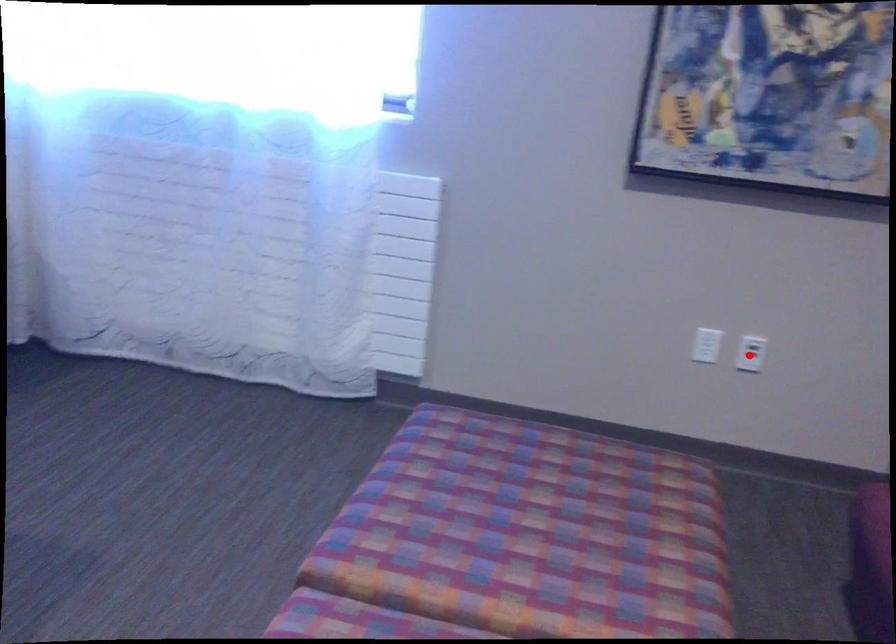
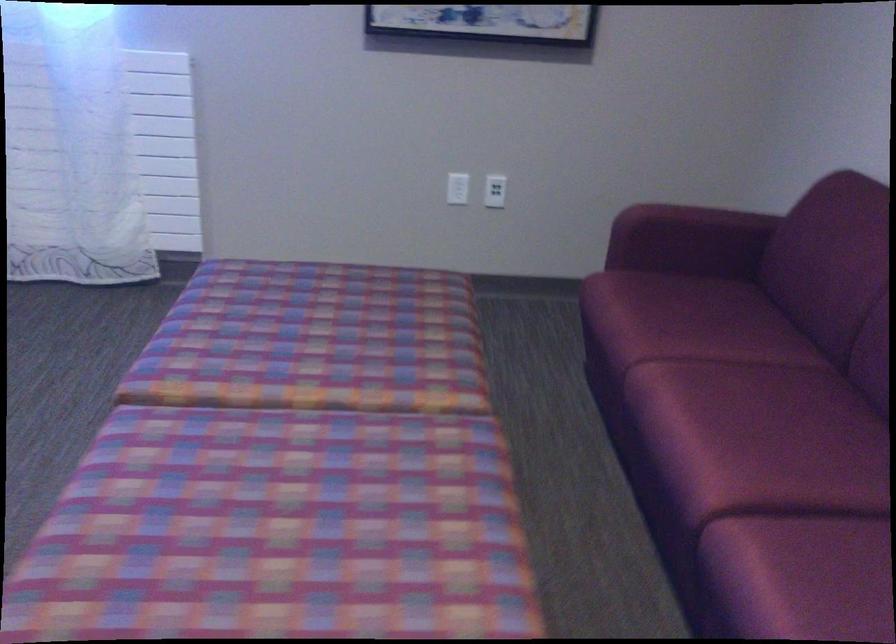
In the second image, find the point that corresponds to the highlighted location in the first image.

(495, 191)